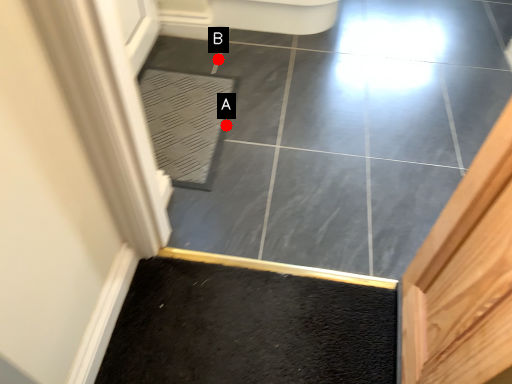
Question: Two points are circled on the image, labeled by A and B beside each circle. Which of the following is the farthest from the observer?

Choices:
 (A) A is further
 (B) B is further

Answer: (B)